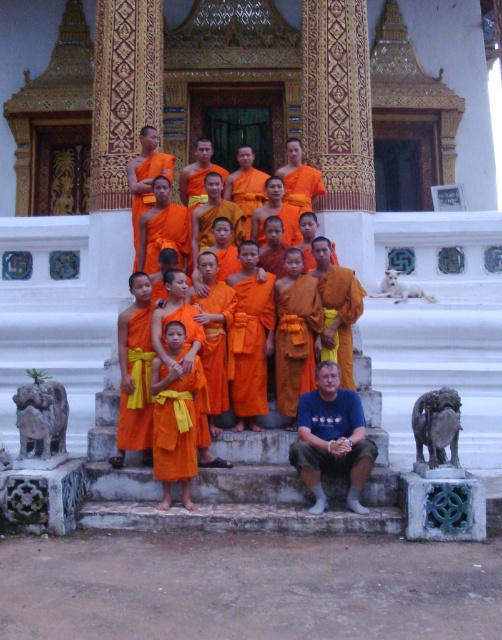
Question: Among these objects, which one is farthest from the camera?

Choices:
 (A) blue t-shirt at lower center
 (B) orange cloth at center

Answer: (B)

Question: Can you confirm if orange cloth at center is wider than blue t-shirt at lower center?

Choices:
 (A) yes
 (B) no

Answer: (A)

Question: Which object is farther from the camera taking this photo?

Choices:
 (A) blue t-shirt at lower center
 (B) orange cloth at center

Answer: (B)

Question: Can you confirm if orange cloth at center is positioned above blue t-shirt at lower center?

Choices:
 (A) yes
 (B) no

Answer: (A)

Question: Among these objects, which one is farthest from the camera?

Choices:
 (A) orange cloth at center
 (B) blue t-shirt at lower center

Answer: (A)

Question: In this image, where is orange cloth at center located relative to blue t-shirt at lower center?

Choices:
 (A) below
 (B) above

Answer: (B)